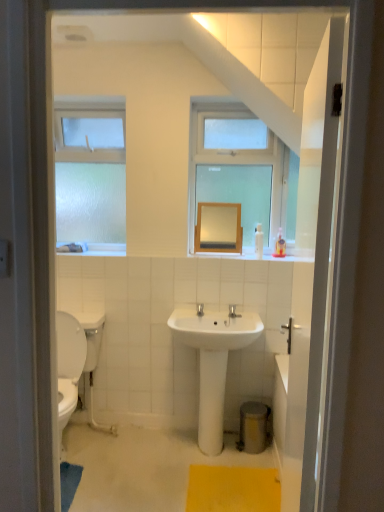
Question: From the image's perspective, is frosted glass window at left beneath smooth wooden mirror at center?

Choices:
 (A) yes
 (B) no

Answer: (B)

Question: Does frosted glass window at left come behind smooth wooden mirror at center?

Choices:
 (A) yes
 (B) no

Answer: (A)

Question: Is frosted glass window at left at the left side of smooth wooden mirror at center?

Choices:
 (A) no
 (B) yes

Answer: (B)

Question: Is frosted glass window at left at the right side of smooth wooden mirror at center?

Choices:
 (A) yes
 (B) no

Answer: (B)

Question: From a real-world perspective, is frosted glass window at left on top of smooth wooden mirror at center?

Choices:
 (A) no
 (B) yes

Answer: (B)

Question: Is frosted glass window at left surrounding smooth wooden mirror at center?

Choices:
 (A) no
 (B) yes

Answer: (A)

Question: From a real-world perspective, does smooth wooden mirror at center sit lower than frosted glass window at left?

Choices:
 (A) no
 (B) yes

Answer: (B)

Question: Can you confirm if smooth wooden mirror at center is positioned to the left of frosted glass window at left?

Choices:
 (A) no
 (B) yes

Answer: (A)

Question: Does smooth wooden mirror at center have a larger size compared to frosted glass window at left?

Choices:
 (A) yes
 (B) no

Answer: (B)

Question: Is smooth wooden mirror at center in front of frosted glass window at left?

Choices:
 (A) no
 (B) yes

Answer: (B)

Question: Is smooth wooden mirror at center far away from frosted glass window at left?

Choices:
 (A) yes
 (B) no

Answer: (B)

Question: Is smooth wooden mirror at center wider than frosted glass window at left?

Choices:
 (A) yes
 (B) no

Answer: (B)

Question: Does yellow textured bath mat at lower center come behind frosted glass window at left?

Choices:
 (A) no
 (B) yes

Answer: (A)